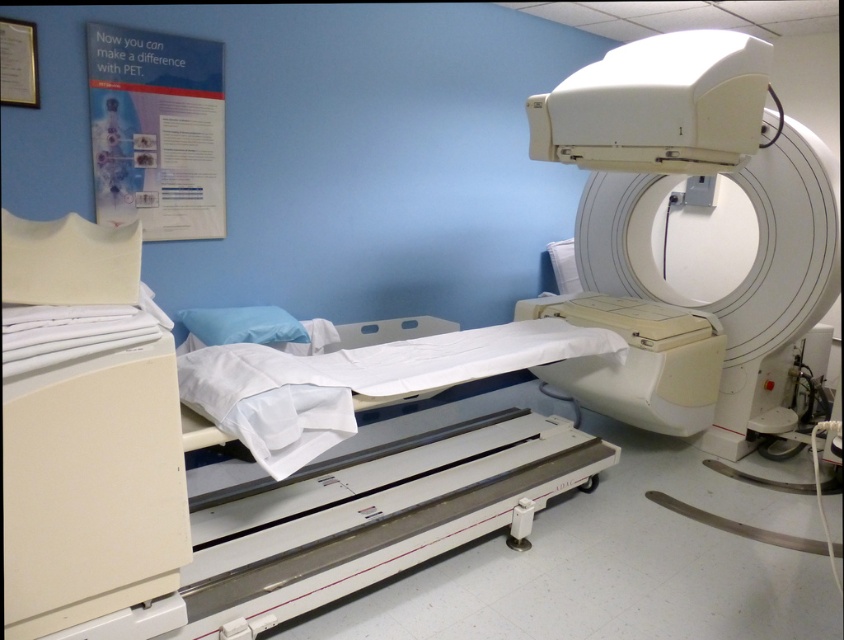
Is beige plastic scanner at center above blue fabric pillow at center?

Actually, beige plastic scanner at center is below blue fabric pillow at center.

Is beige plastic scanner at center positioned before blue fabric pillow at center?

No.

Find the location of a particular element. The width and height of the screenshot is (844, 640). beige plastic scanner at center is located at coordinates (639, 360).

Who is positioned more to the right, white paper at upper left or blue fabric pillow at center?

blue fabric pillow at center

What do you see at coordinates (155, 131) in the screenshot? This screenshot has height=640, width=844. I see `white paper at upper left` at bounding box center [155, 131].

Which is in front, point (168, 214) or point (287, 317)?

Point (168, 214) is more forward.

The width and height of the screenshot is (844, 640). I want to click on white paper at upper left, so click(155, 131).

Can you confirm if white paper at upper left is positioned to the left of beige plastic scanner at center?

Correct, you'll find white paper at upper left to the left of beige plastic scanner at center.

Does white paper at upper left have a greater width compared to beige plastic scanner at center?

No.

Locate an element on the screen. white paper at upper left is located at coordinates (155, 131).